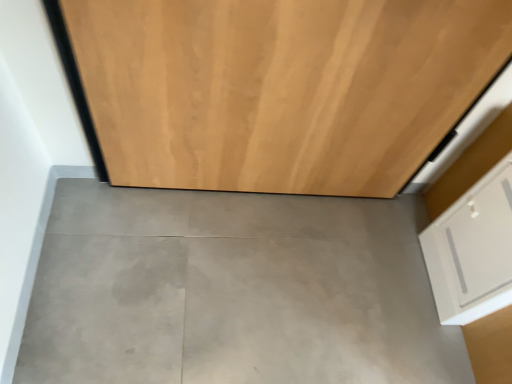
Question: Is wooden door at center at the back of white matte drawer at lower right?

Choices:
 (A) yes
 (B) no

Answer: (B)

Question: From the image's perspective, is white matte drawer at lower right under wooden door at center?

Choices:
 (A) no
 (B) yes

Answer: (B)

Question: From the image's perspective, does white matte drawer at lower right appear higher than wooden door at center?

Choices:
 (A) yes
 (B) no

Answer: (B)

Question: Considering the relative positions of white matte drawer at lower right and wooden door at center in the image provided, is white matte drawer at lower right to the left of wooden door at center from the viewer's perspective?

Choices:
 (A) yes
 (B) no

Answer: (B)

Question: Can you confirm if white matte drawer at lower right is shorter than wooden door at center?

Choices:
 (A) yes
 (B) no

Answer: (A)

Question: Is white matte drawer at lower right in front of or behind gray concrete floor at center in the image?

Choices:
 (A) front
 (B) behind

Answer: (A)

Question: In terms of size, does white matte drawer at lower right appear bigger or smaller than gray concrete floor at center?

Choices:
 (A) big
 (B) small

Answer: (B)

Question: In terms of width, does white matte drawer at lower right look wider or thinner when compared to gray concrete floor at center?

Choices:
 (A) thin
 (B) wide

Answer: (A)

Question: From the image's perspective, relative to gray concrete floor at center, is white matte drawer at lower right above or below?

Choices:
 (A) below
 (B) above

Answer: (B)

Question: Considering the relative positions of white matte drawer at lower right and wooden door at center in the image provided, is white matte drawer at lower right to the left or to the right of wooden door at center?

Choices:
 (A) left
 (B) right

Answer: (B)

Question: Which is correct: white matte drawer at lower right is inside wooden door at center, or outside of it?

Choices:
 (A) inside
 (B) outside

Answer: (B)

Question: Looking at their shapes, would you say white matte drawer at lower right is wider or thinner than wooden door at center?

Choices:
 (A) thin
 (B) wide

Answer: (A)

Question: In terms of size, does white matte drawer at lower right appear bigger or smaller than wooden door at center?

Choices:
 (A) big
 (B) small

Answer: (B)

Question: From their relative heights in the image, would you say wooden door at center is taller or shorter than white matte drawer at lower right?

Choices:
 (A) tall
 (B) short

Answer: (A)

Question: Is wooden door at center wider or thinner than white matte drawer at lower right?

Choices:
 (A) thin
 (B) wide

Answer: (B)